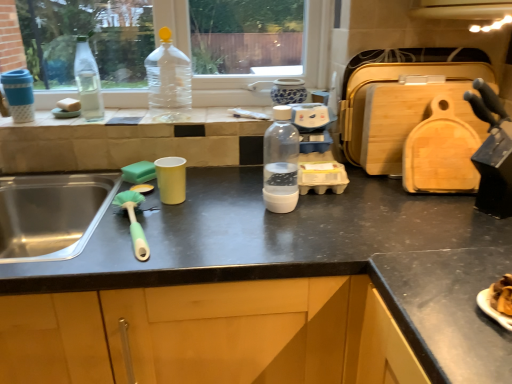
The height and width of the screenshot is (384, 512). What are the coordinates of `vacant area that is in front of green plastic brush at left` in the screenshot? It's located at (100, 261).